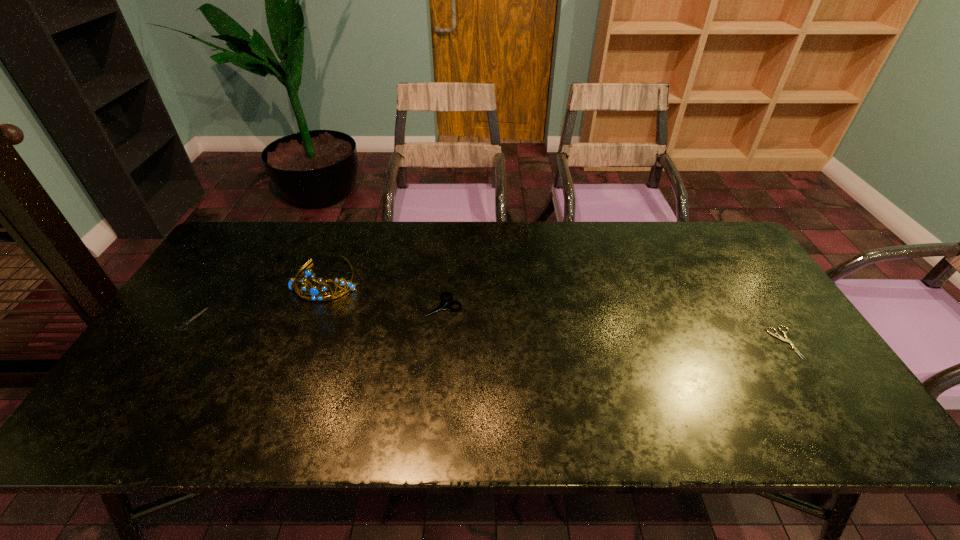
Identify the location of the third closest object to the tallest object. This screenshot has height=540, width=960. [778, 336].

The width and height of the screenshot is (960, 540). Find the location of `shears that is the closest to the tallest shears`. shears that is the closest to the tallest shears is located at coordinates (x=186, y=323).

Find the location of a particular element. Image resolution: width=960 pixels, height=540 pixels. shears that is the nearest to the second shears from left to right is located at coordinates (186, 323).

At what (x,y) coordinates should I click in order to perform the action: click on blank space that satisfies the following two spatial constraints: 1. on the front side of the third object from left to right; 2. on the right side of the rightmost shears. Please return your answer as a coordinate pair (x, y). Image resolution: width=960 pixels, height=540 pixels. Looking at the image, I should click on (440, 342).

The height and width of the screenshot is (540, 960). I want to click on vacant space that satisfies the following two spatial constraints: 1. on the front-facing side of the tallest object; 2. on the right side of the tallest shears, so click(317, 306).

Find the location of a particular element. The image size is (960, 540). vacant region that satisfies the following two spatial constraints: 1. on the front-facing side of the tallest shears; 2. on the right side of the tallest object is located at coordinates (317, 306).

Identify the location of blank space that satisfies the following two spatial constraints: 1. on the front-facing side of the second object from left to right; 2. on the left side of the rightmost object. The width and height of the screenshot is (960, 540). (302, 342).

Locate an element on the screen. free space in the image that satisfies the following two spatial constraints: 1. on the front-facing side of the tiara; 2. on the left side of the rightmost object is located at coordinates (302, 342).

This screenshot has width=960, height=540. What are the coordinates of `vacant space that satisfies the following two spatial constraints: 1. on the front-facing side of the tallest object; 2. on the left side of the rightmost shears` in the screenshot? It's located at (302, 342).